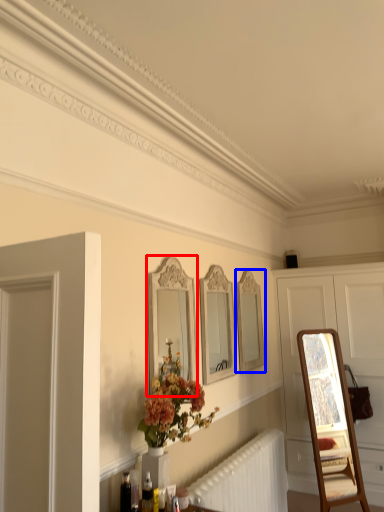
Question: Among these objects, which one is nearest to the camera, mirror (highlighted by a red box) or mirror (highlighted by a blue box)?

Choices:
 (A) mirror
 (B) mirror

Answer: (A)